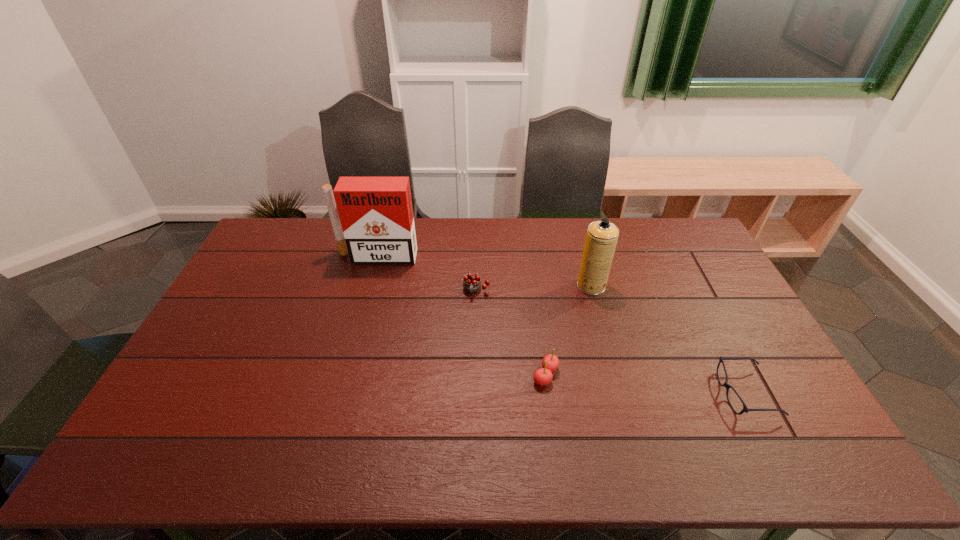
You are a GUI agent. You are given a task and a screenshot of the screen. Output one action in this format:
    pyautogui.click(x=<x>, y=<y>)
    Task: Click on the cigarette case
    This screenshot has height=540, width=960.
    Given the screenshot: What is the action you would take?
    pyautogui.click(x=376, y=213)

This screenshot has width=960, height=540. Identify the location of the farthest object. (376, 213).

In order to click on the fourth object from left to right in this screenshot , I will do `click(601, 239)`.

At what (x,y) coordinates should I click in order to perform the action: click on the fourth object from right to left. Please return your answer as a coordinate pair (x, y). Looking at the image, I should click on (472, 282).

Identify the location of the farther cherry. The height and width of the screenshot is (540, 960). (472, 282).

At what (x,y) coordinates should I click in order to perform the action: click on the right cherry. Please return your answer as a coordinate pair (x, y). Looking at the image, I should click on (543, 376).

Identify the location of the third object from left to right. (543, 376).

Where is `spectacles`? The width and height of the screenshot is (960, 540). spectacles is located at coordinates (745, 409).

Identify the location of the rightmost object. (745, 409).

Locate an element on the screen. vacant space situated on the front-facing side of the leftmost object is located at coordinates (352, 347).